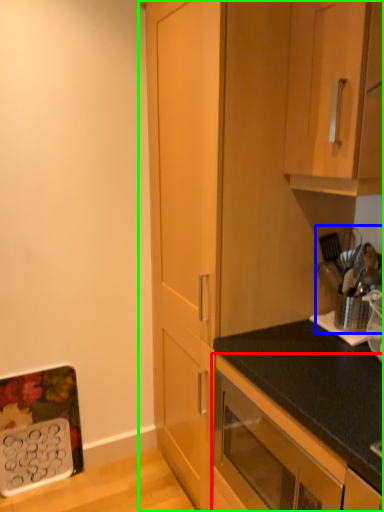
Question: Estimate the real-world distances between objects in this image. Which object is closer to cabinetry (highlighted by a red box), appliance (highlighted by a blue box) or cabinetry (highlighted by a green box)?

Choices:
 (A) appliance
 (B) cabinetry

Answer: (B)